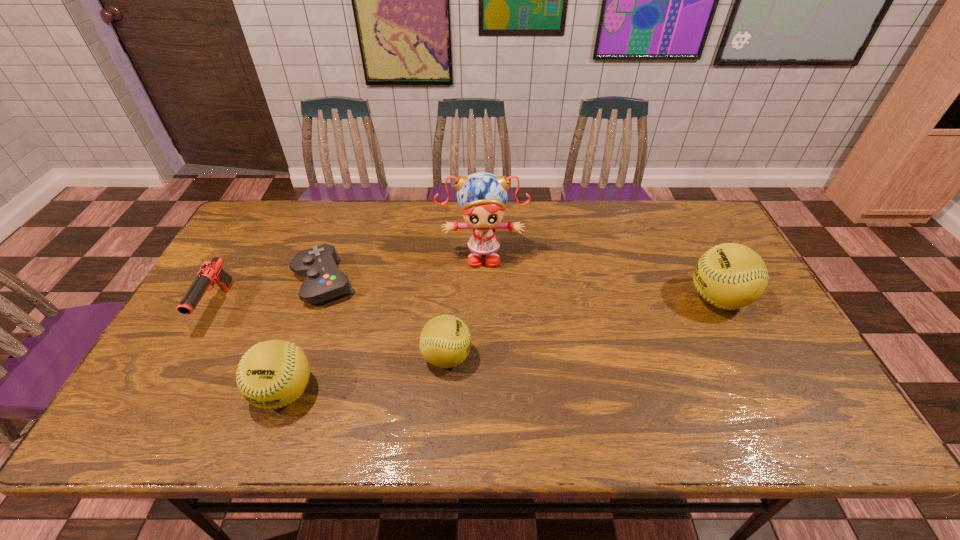
In the image, there is a desktop. At what (x,y) coordinates should I click in order to perform the action: click on blank space at the right edge. Please return your answer as a coordinate pair (x, y). This screenshot has height=540, width=960. Looking at the image, I should click on (740, 343).

Locate an element on the screen. Image resolution: width=960 pixels, height=540 pixels. vacant space at the near left corner is located at coordinates (169, 395).

The image size is (960, 540). In the image, there is a desktop. In order to click on blank space at the near right corner in this screenshot , I will do `click(796, 387)`.

You are a GUI agent. You are given a task and a screenshot of the screen. Output one action in this format:
    pyautogui.click(x=<x>, y=<y>)
    Task: Click on the vacant area that lies between the shortest softball and the tallest object
    The height and width of the screenshot is (540, 960).
    Given the screenshot: What is the action you would take?
    pyautogui.click(x=465, y=305)

I want to click on free space between the second tallest softball and the second softball from left to right, so click(x=366, y=374).

At what (x,y) coordinates should I click in order to perform the action: click on vacant region between the doll and the shortest softball. Please return your answer as a coordinate pair (x, y). This screenshot has width=960, height=540. Looking at the image, I should click on click(465, 305).

Where is `vacant space that is in between the shortest softball and the rightmost object`? This screenshot has height=540, width=960. vacant space that is in between the shortest softball and the rightmost object is located at coordinates (582, 327).

You are a GUI agent. You are given a task and a screenshot of the screen. Output one action in this format:
    pyautogui.click(x=<x>, y=<y>)
    Task: Click on the free area in between the rightmost softball and the shortest object
    This screenshot has width=960, height=540.
    Given the screenshot: What is the action you would take?
    pyautogui.click(x=520, y=290)

Locate an element on the screen. vacant space that is in between the control and the leftmost softball is located at coordinates [304, 337].

I want to click on unoccupied area between the shortest object and the second softball from left to right, so click(x=385, y=319).